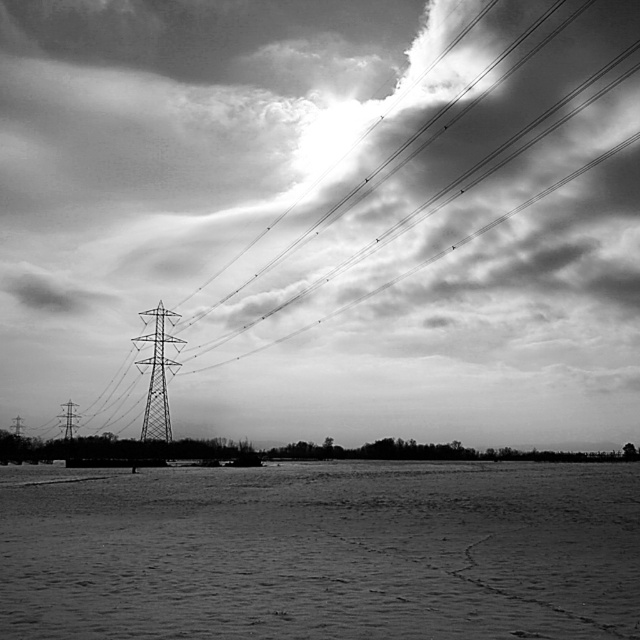
Question: Does metallic tower at left appear on the right side of metallic grid tower at left?

Choices:
 (A) yes
 (B) no

Answer: (A)

Question: Where is smooth sand at lower center located in relation to metallic grid tower at center in the image?

Choices:
 (A) below
 (B) above

Answer: (A)

Question: Where is metallic grid tower at center located in relation to metallic tower at left in the image?

Choices:
 (A) above
 (B) below

Answer: (A)

Question: Which point is farther to the camera?

Choices:
 (A) (545, 465)
 (B) (160, 413)
 (C) (19, 417)

Answer: (C)

Question: Which object is closer to the camera taking this photo?

Choices:
 (A) metallic grid tower at left
 (B) metallic grid tower at center
 (C) smooth sand at lower center
 (D) cloudy sky at upper center

Answer: (C)

Question: Based on their relative distances, which object is nearer to the cloudy sky at upper center?

Choices:
 (A) smooth sand at lower center
 (B) metallic tower at left
 (C) metallic grid tower at center

Answer: (C)